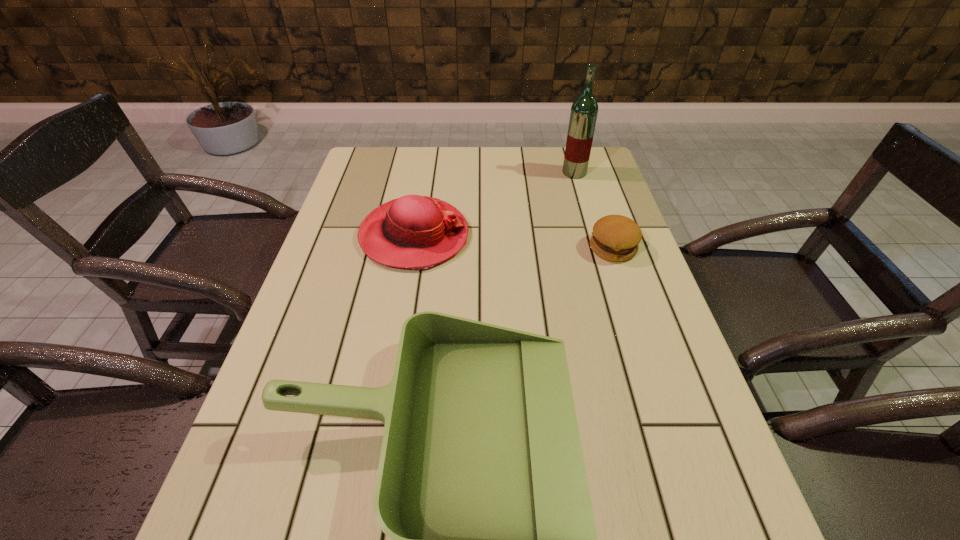
You are a GUI agent. You are given a task and a screenshot of the screen. Output one action in this format:
    pyautogui.click(x=<x>, y=<y>)
    Task: Click on the liquor
    The width and height of the screenshot is (960, 540).
    Given the screenshot: What is the action you would take?
    (x=584, y=110)

Identify the location of the tallest object. (584, 110).

Image resolution: width=960 pixels, height=540 pixels. I want to click on hat, so click(417, 232).

Find the location of `the shortest object`. the shortest object is located at coordinates (615, 238).

You are a GUI agent. You are given a task and a screenshot of the screen. Output one action in this format:
    pyautogui.click(x=<x>, y=<y>)
    Task: Click on the vacant area located 0.090m on the back of the tallest object
    Image resolution: width=960 pixels, height=540 pixels.
    Given the screenshot: What is the action you would take?
    pyautogui.click(x=568, y=153)

Where is `vacant space situated 0.270m at the front of the hat with a bow`? The width and height of the screenshot is (960, 540). vacant space situated 0.270m at the front of the hat with a bow is located at coordinates (568, 236).

The width and height of the screenshot is (960, 540). I want to click on blank space located 0.220m on the back of the shortest object, so coord(593,189).

What are the coordinates of `object present at the far edge` in the screenshot? It's located at (584, 110).

The width and height of the screenshot is (960, 540). I want to click on object positioned at the left edge, so click(x=417, y=232).

Identify the location of liquor that is at the right edge. (584, 110).